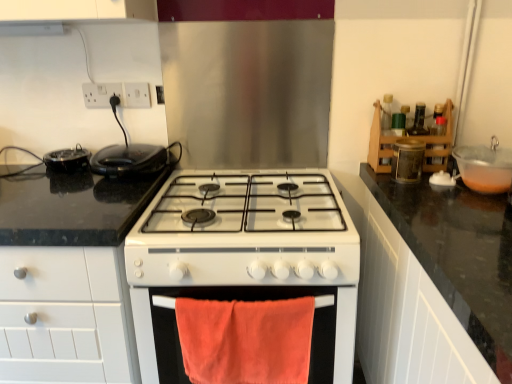
Question: From a real-world perspective, is transparent plastic bowl at right positioned over white glossy gas stove at center based on gravity?

Choices:
 (A) yes
 (B) no

Answer: (A)

Question: Considering the relative sizes of transparent plastic bowl at right and white glossy gas stove at center in the image provided, is transparent plastic bowl at right shorter than white glossy gas stove at center?

Choices:
 (A) no
 (B) yes

Answer: (B)

Question: Is white glossy gas stove at center located within transparent plastic bowl at right?

Choices:
 (A) yes
 (B) no

Answer: (B)

Question: Is transparent plastic bowl at right thinner than white glossy gas stove at center?

Choices:
 (A) yes
 (B) no

Answer: (A)

Question: Can we say transparent plastic bowl at right lies outside white glossy gas stove at center?

Choices:
 (A) no
 (B) yes

Answer: (B)

Question: Relative to orange cotton towel at lower center, is black glossy pan at left, which ranks as the 1th kitchen appliance in left-to-right order, in front or behind?

Choices:
 (A) front
 (B) behind

Answer: (B)

Question: Looking at their shapes, would you say black glossy pan at left, which ranks as the 1th kitchen appliance in left-to-right order, is wider or thinner than orange cotton towel at lower center?

Choices:
 (A) thin
 (B) wide

Answer: (B)

Question: From the image's perspective, relative to orange cotton towel at lower center, is black glossy pan at left, arranged as the 2th kitchen appliance when viewed from the right, above or below?

Choices:
 (A) above
 (B) below

Answer: (A)

Question: Visually, is black glossy pan at left, arranged as the 2th kitchen appliance when viewed from the right, positioned to the left or to the right of orange cotton towel at lower center?

Choices:
 (A) right
 (B) left

Answer: (B)

Question: Considering the relative positions of orange cotton towel at lower center and black granite countertop at left in the image provided, is orange cotton towel at lower center to the left or to the right of black granite countertop at left?

Choices:
 (A) right
 (B) left

Answer: (A)

Question: From the image's perspective, is orange cotton towel at lower center above or below black granite countertop at left?

Choices:
 (A) above
 (B) below

Answer: (A)

Question: Relative to black granite countertop at left, is orange cotton towel at lower center in front or behind?

Choices:
 (A) behind
 (B) front

Answer: (A)

Question: Does point [263, 299] appear closer or farther from the camera than point [42, 281]?

Choices:
 (A) closer
 (B) farther

Answer: (A)

Question: Considering the positions of white plastic socket at upper left, which appears as the second electric outlet when viewed from the right, and orange cotton towel at lower center in the image, is white plastic socket at upper left, which appears as the second electric outlet when viewed from the right, wider or thinner than orange cotton towel at lower center?

Choices:
 (A) thin
 (B) wide

Answer: (A)

Question: From a real-world perspective, is white plastic socket at upper left, which appears as the second electric outlet when viewed from the right, above or below orange cotton towel at lower center?

Choices:
 (A) above
 (B) below

Answer: (A)